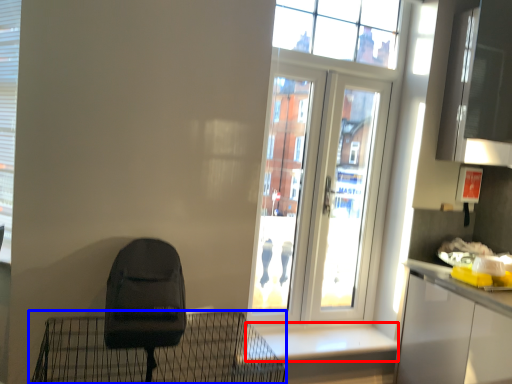
Question: Which object appears farthest to the camera in this image, window sill (highlighted by a red box) or furniture (highlighted by a blue box)?

Choices:
 (A) window sill
 (B) furniture

Answer: (A)